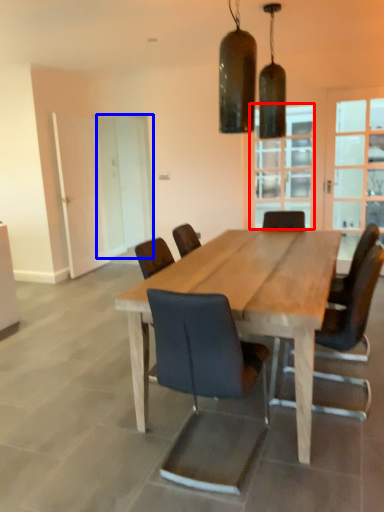
Question: Which object appears farthest to the camera in this image, window (highlighted by a red box) or screen door (highlighted by a blue box)?

Choices:
 (A) window
 (B) screen door

Answer: (B)